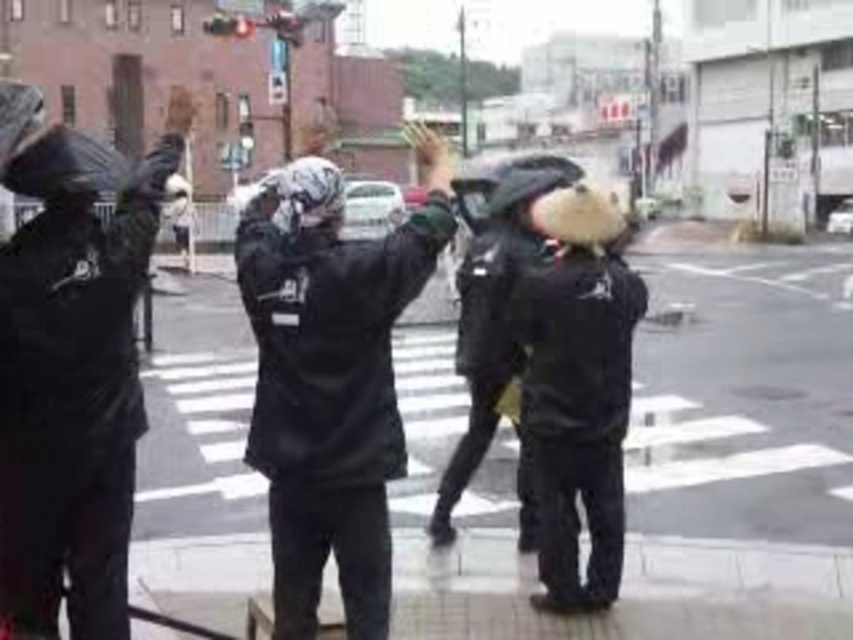
Question: Is matte black jacket at left thinner than matte black jacket at center?

Choices:
 (A) yes
 (B) no

Answer: (A)

Question: Which point is farther to the camera?

Choices:
 (A) (392, 316)
 (B) (30, 256)

Answer: (A)

Question: Does matte black jacket at left have a smaller size compared to matte black jacket at center?

Choices:
 (A) yes
 (B) no

Answer: (A)

Question: Which point is closer to the camera taking this photo?

Choices:
 (A) (3, 172)
 (B) (277, 627)

Answer: (A)

Question: Does matte black jacket at left have a smaller size compared to matte black jacket at center?

Choices:
 (A) yes
 (B) no

Answer: (A)